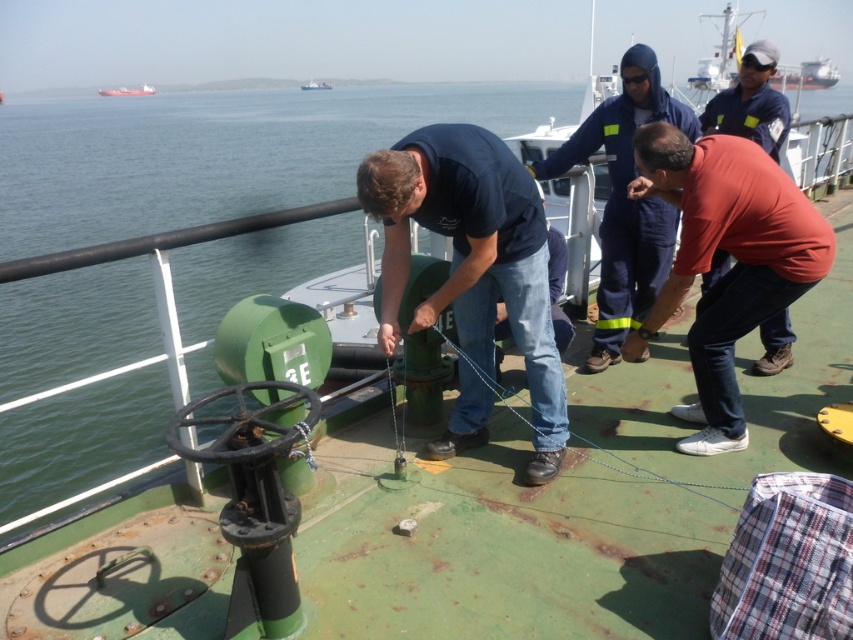
You are standing on the ship deck and need to move from the dark blue uniform at center to the red matte cargo ship at upper left. Can you pass through the space between them?

The dark blue uniform at center has a lesser width compared to red matte cargo ship at upper left. Therefore, there is enough space to pass through the area between them.

You are a deckhand on the ship and need to secure a rope to the green matte bollard at center. The person wearing the matte red shirt at center is standing in the way. Which direction should you move to avoid them?

The matte red shirt at center is to the right of the green matte bollard at center, so you should move to the left to avoid them.

You are standing on the ship deck and need to locate the person wearing the matte red shirt at center. What are their coordinates?

The coordinates of the matte red shirt at center are at point (732, 266).